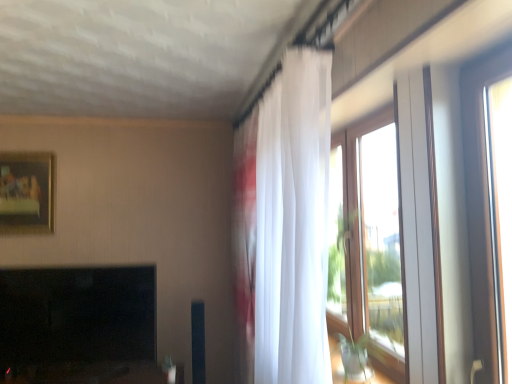
Question: Is point (25, 319) positioned closer to the camera than point (50, 167)?

Choices:
 (A) farther
 (B) closer

Answer: (B)

Question: Relative to matte gold picture frame at upper left, is black glossy fireplace at lower left in front or behind?

Choices:
 (A) front
 (B) behind

Answer: (A)

Question: Considering the real-world distances, which object is farthest from the white sheer curtain at upper right?

Choices:
 (A) black glossy fireplace at lower left
 (B) matte gold picture frame at upper left
 (C) clear glass window at right

Answer: (B)

Question: Considering the real-world distances, which object is farthest from the white sheer curtain at upper right?

Choices:
 (A) black glossy fireplace at lower left
 (B) matte gold picture frame at upper left
 (C) clear glass window at right

Answer: (B)